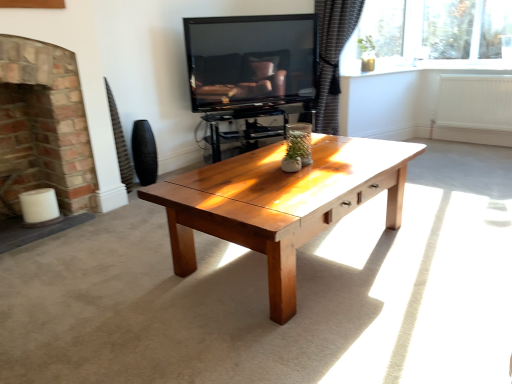
Locate an element on the screen. The width and height of the screenshot is (512, 384). free point to the left of white painted radiator at right is located at coordinates click(x=439, y=150).